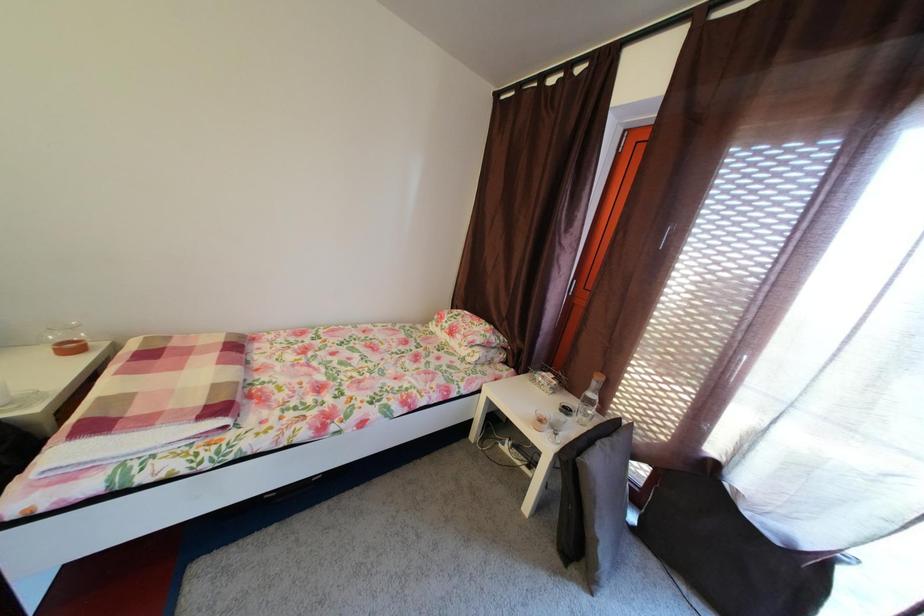
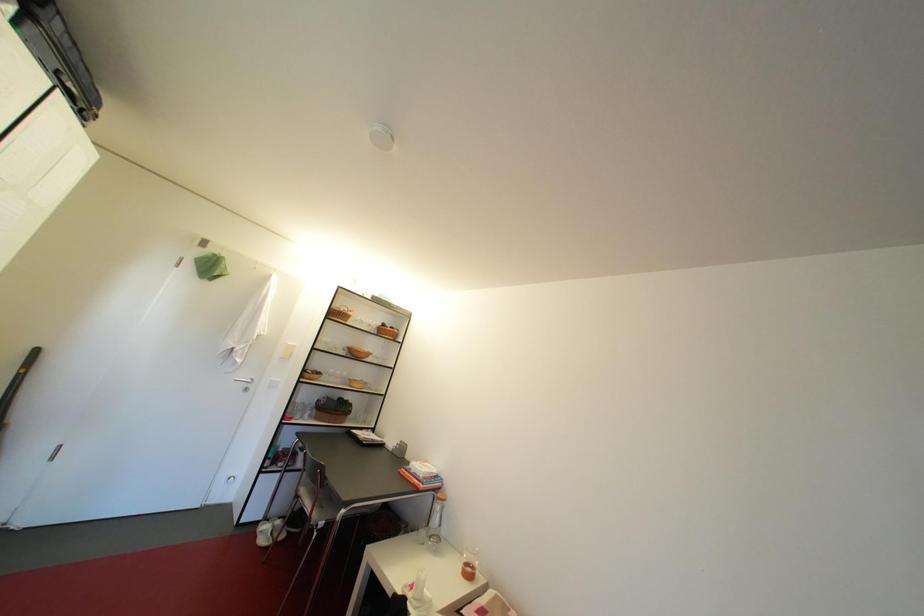
First-person continuous shooting, in which direction is the camera rotating?

The camera's rotation is toward left-up.